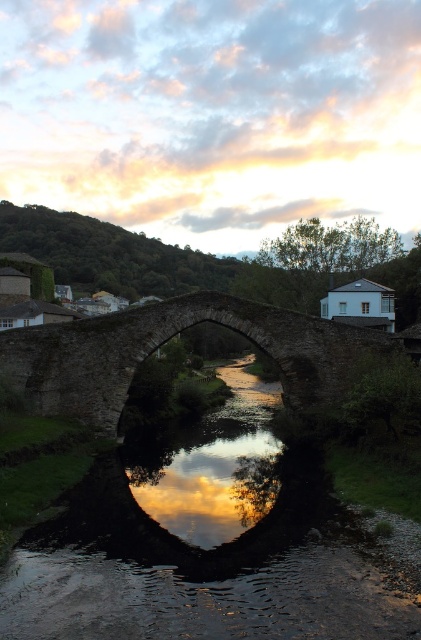
Is point (205, 609) behind point (98, 380)?

No, it is not.

Is reflective stone river at center wider than stone arch bridge at center?

Incorrect, reflective stone river at center's width does not surpass stone arch bridge at center's.

Is point (296, 632) farther from camera compared to point (84, 337)?

No, it is in front of (84, 337).

This screenshot has height=640, width=421. Identify the location of reflective stone river at center. (202, 598).